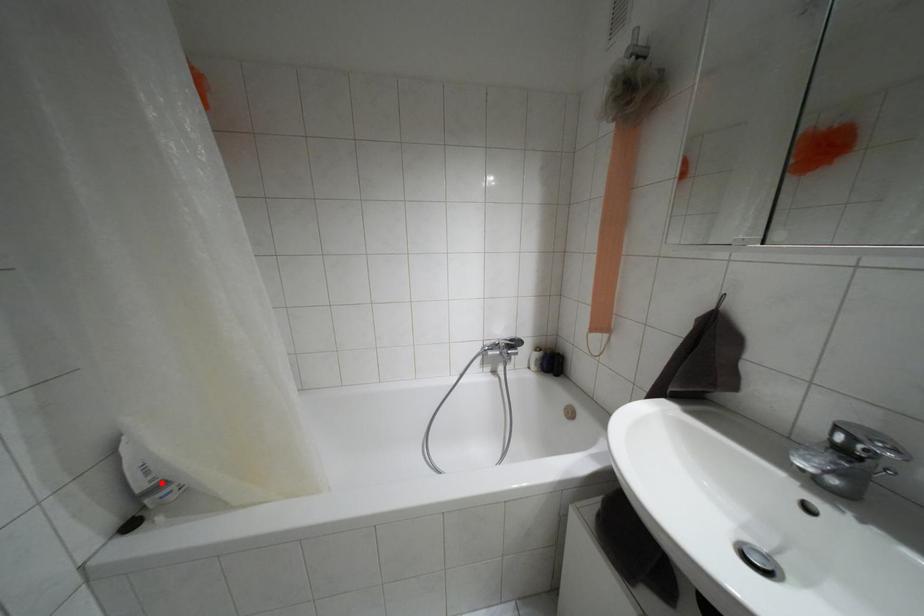
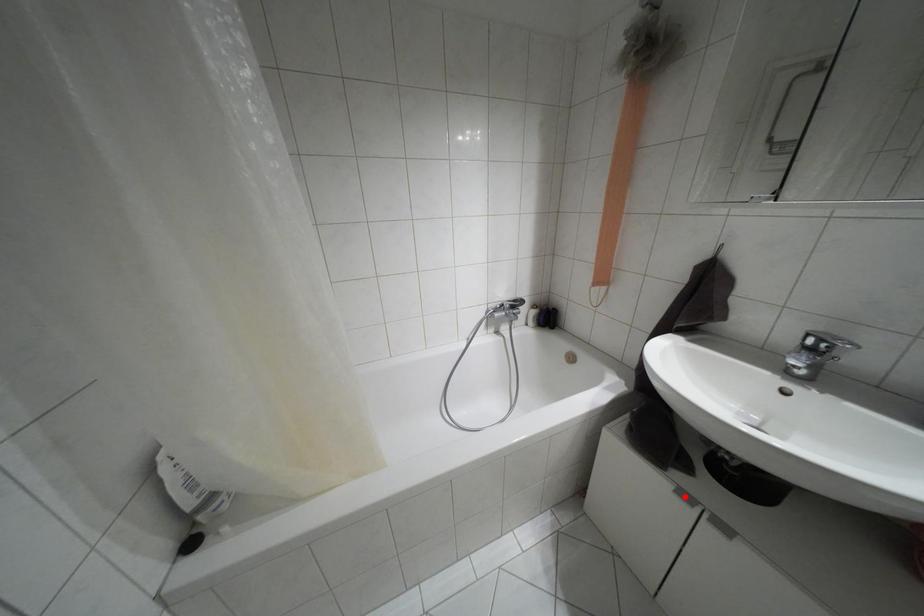
I am providing you with two images of the same scene from different viewpoints. A red point is marked on the first image and another point is marked on the second image. Is the marked point in image1 the same physical position as the marked point in image2?

No